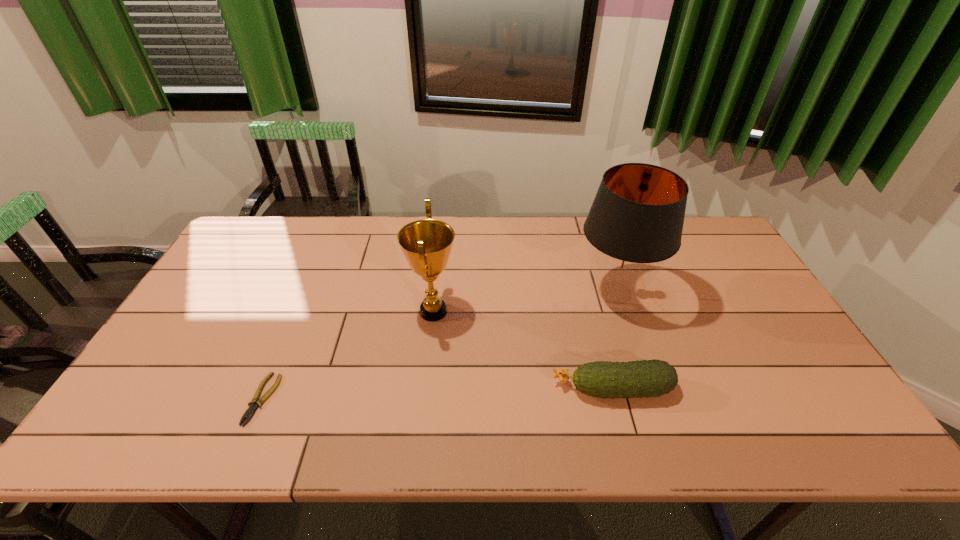
At what (x,y) coordinates should I click in order to perform the action: click on the closest object to the lampshade. Please return your answer as a coordinate pair (x, y). The height and width of the screenshot is (540, 960). Looking at the image, I should click on (648, 378).